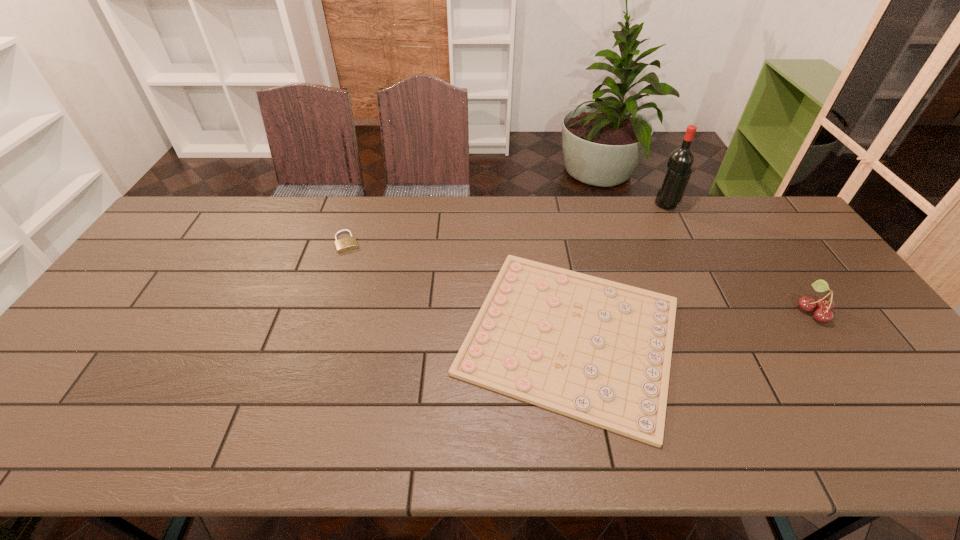
Find the location of `free space that is in between the tallest object and the third shortest object`. free space that is in between the tallest object and the third shortest object is located at coordinates (739, 258).

Image resolution: width=960 pixels, height=540 pixels. What are the coordinates of `free spot between the second tallest object and the tallest object` in the screenshot? It's located at (739, 258).

Locate which object is the third closest to the padlock. Please provide its 2D coordinates. Your answer should be formatted as a tuple, i.e. [(x, y)], where the tuple contains the x and y coordinates of a point satisfying the conditions above.

[(824, 305)]

Identify which object is the second closest to the tallest object. Please provide its 2D coordinates. Your answer should be formatted as a tuple, i.e. [(x, y)], where the tuple contains the x and y coordinates of a point satisfying the conditions above.

[(824, 305)]

This screenshot has height=540, width=960. I want to click on vacant space that satisfies the following two spatial constraints: 1. on the front side of the third nearest object; 2. on the right side of the gameboard, so click(316, 335).